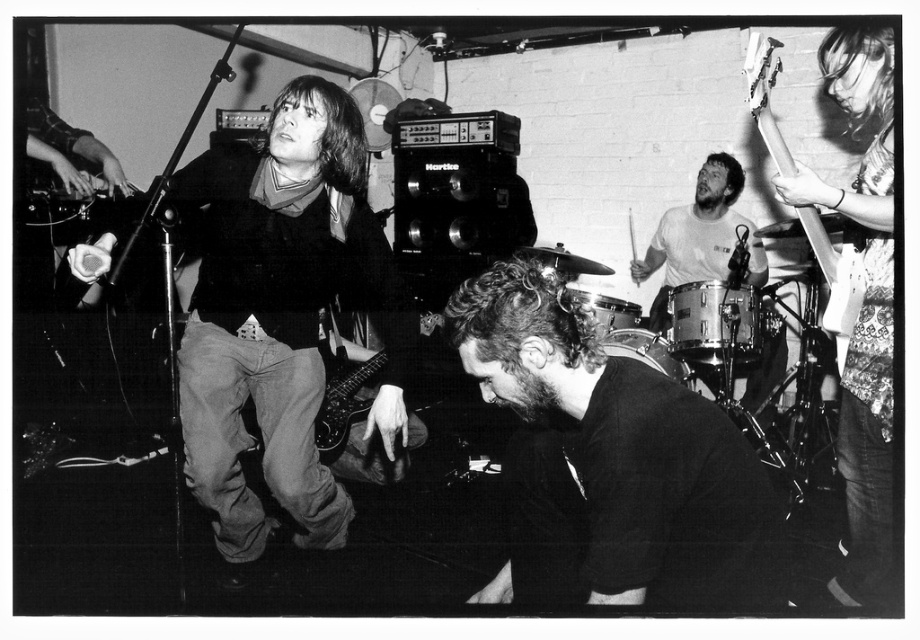
In the scene shown: Does black matte shirt at center have a lesser height compared to patterned fabric guitar at right?

Indeed, black matte shirt at center has a lesser height compared to patterned fabric guitar at right.

What are the coordinates of `black matte shirt at center` in the screenshot? It's located at (608, 460).

Which is above, black matte shirt at center or metallic silver guitar at upper right?

metallic silver guitar at upper right is above.

Where is `black matte shirt at center`? The width and height of the screenshot is (920, 640). black matte shirt at center is located at coordinates (608, 460).

Does patterned fabric guitar at right have a greater width compared to metallic dark guitar at lower center?

Indeed, patterned fabric guitar at right has a greater width compared to metallic dark guitar at lower center.

Between point (888, 456) and point (369, 404), which one is positioned behind?

The point (369, 404) is more distant.

Which is behind, point (854, 540) or point (386, 358)?

The point (386, 358) is behind.

What are the coordinates of `patterned fabric guitar at right` in the screenshot? It's located at (861, 298).